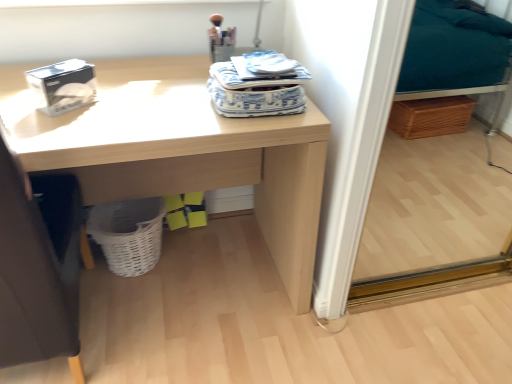
At what (x,y) coordinates should I click in order to perform the action: click on vacant space positioned to the left of white matte tissue box at upper left, marked as the second box in a back-to-front arrangement. Please return your answer as a coordinate pair (x, y). Looking at the image, I should click on (22, 100).